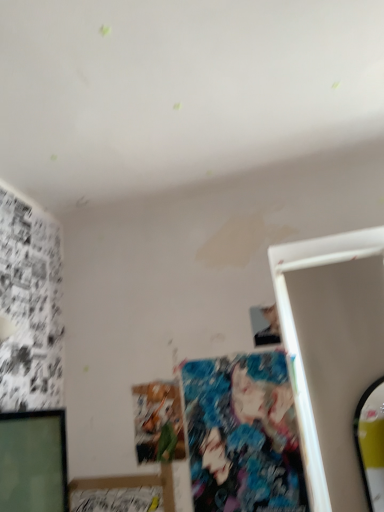
The width and height of the screenshot is (384, 512). What do you see at coordinates (158, 422) in the screenshot?
I see `matte paper poster at center, positioned as the 2th art in right-to-left order` at bounding box center [158, 422].

Where is `colorful fabric poster at center, acting as the second art starting from the left`? colorful fabric poster at center, acting as the second art starting from the left is located at coordinates (243, 435).

From a real-world perspective, does smooth black phone at upper right stand above matte paper poster at center, which is counted as the 1th art, starting from the left?

Correct, in the physical world, smooth black phone at upper right is higher than matte paper poster at center, which is counted as the 1th art, starting from the left.

Which is in front, point (264, 314) or point (159, 441)?

The point (159, 441) is more forward.

Is smooth black phone at upper right directly adjacent to matte paper poster at center, which is counted as the 1th art, starting from the left?

smooth black phone at upper right and matte paper poster at center, which is counted as the 1th art, starting from the left, are clearly separated.

How many degrees apart are the facing directions of smooth black phone at upper right and colorful fabric poster at center, acting as the 1th art starting from the right?

The angle between the facing direction of smooth black phone at upper right and the facing direction of colorful fabric poster at center, acting as the 1th art starting from the right, is 0.298 degrees.

Looking at this image, choose the correct answer: Is smooth black phone at upper right inside colorful fabric poster at center, acting as the 1th art starting from the right, or outside it?

smooth black phone at upper right is located beyond the bounds of colorful fabric poster at center, acting as the 1th art starting from the right.

Between smooth black phone at upper right and colorful fabric poster at center, acting as the 1th art starting from the right, which one has more height?

Standing taller between the two is colorful fabric poster at center, acting as the 1th art starting from the right.

Find the location of a particular element. person located on the right of colorful fabric poster at center, acting as the 1th art starting from the right is located at coordinates (265, 325).

Between colorful fabric poster at center, acting as the second art starting from the left, and matte paper poster at center, positioned as the 2th art in right-to-left order, which one has less height?

With less height is matte paper poster at center, positioned as the 2th art in right-to-left order.

Which is in front, point (269, 447) or point (171, 384)?

The point (269, 447) is more forward.

Considering the relative sizes of colorful fabric poster at center, acting as the second art starting from the left, and matte paper poster at center, positioned as the 2th art in right-to-left order, in the image provided, is colorful fabric poster at center, acting as the second art starting from the left, bigger than matte paper poster at center, positioned as the 2th art in right-to-left order,?

Indeed, colorful fabric poster at center, acting as the second art starting from the left, has a larger size compared to matte paper poster at center, positioned as the 2th art in right-to-left order.

Which object is positioned more to the left, colorful fabric poster at center, acting as the 1th art starting from the right, or matte paper poster at center, which is counted as the 1th art, starting from the left?

Positioned to the left is matte paper poster at center, which is counted as the 1th art, starting from the left.

Where is `person above the colorful fabric poster at center, acting as the second art starting from the left (from a real-world perspective)`? The height and width of the screenshot is (512, 384). person above the colorful fabric poster at center, acting as the second art starting from the left (from a real-world perspective) is located at coordinates (265, 325).

Could you tell me if colorful fabric poster at center, acting as the 1th art starting from the right, is turned towards smooth black phone at upper right?

No, colorful fabric poster at center, acting as the 1th art starting from the right, is not aimed at smooth black phone at upper right.

Which object is further away from the camera taking this photo, colorful fabric poster at center, acting as the 1th art starting from the right, or smooth black phone at upper right?

smooth black phone at upper right is more distant.

Is smooth black phone at upper right a part of colorful fabric poster at center, acting as the second art starting from the left?

No, colorful fabric poster at center, acting as the second art starting from the left, does not contain smooth black phone at upper right.

From the image's perspective, is matte paper poster at center, which is counted as the 1th art, starting from the left, located above smooth black phone at upper right?

Incorrect, from the image's perspective, matte paper poster at center, which is counted as the 1th art, starting from the left, is lower than smooth black phone at upper right.

Which is behind, matte paper poster at center, which is counted as the 1th art, starting from the left, or smooth black phone at upper right?

smooth black phone at upper right.

Does matte paper poster at center, which is counted as the 1th art, starting from the left, turn towards smooth black phone at upper right?

No, matte paper poster at center, which is counted as the 1th art, starting from the left, is not facing towards smooth black phone at upper right.

Locate an element on the screen. The width and height of the screenshot is (384, 512). art that appears below the colorful fabric poster at center, acting as the second art starting from the left (from the image's perspective) is located at coordinates (158, 422).

From their relative heights in the image, would you say matte paper poster at center, positioned as the 2th art in right-to-left order, is taller or shorter than colorful fabric poster at center, acting as the second art starting from the left?

matte paper poster at center, positioned as the 2th art in right-to-left order, is shorter than colorful fabric poster at center, acting as the second art starting from the left.

How much distance is there between matte paper poster at center, positioned as the 2th art in right-to-left order, and colorful fabric poster at center, acting as the second art starting from the left?

They are 8.07 inches apart.

In the scene shown: Which object is more forward, matte paper poster at center, which is counted as the 1th art, starting from the left, or colorful fabric poster at center, acting as the 1th art starting from the right?

colorful fabric poster at center, acting as the 1th art starting from the right, is in front.

Identify the location of the 1st art in front of the smooth black phone at upper right, counting from the anchor's position. The width and height of the screenshot is (384, 512). pos(158,422).

Locate an element on the screen. The height and width of the screenshot is (512, 384). person that appears above the colorful fabric poster at center, acting as the 1th art starting from the right (from the image's perspective) is located at coordinates (265, 325).

Looking at the image, which one is located further to colorful fabric poster at center, acting as the 1th art starting from the right, matte paper poster at center, positioned as the 2th art in right-to-left order, or smooth black phone at upper right?

smooth black phone at upper right lies further to colorful fabric poster at center, acting as the 1th art starting from the right, than the other object.

When comparing their distances from smooth black phone at upper right, does colorful fabric poster at center, acting as the second art starting from the left, or matte paper poster at center, positioned as the 2th art in right-to-left order, seem further?

matte paper poster at center, positioned as the 2th art in right-to-left order.

Which object lies nearer to the anchor point matte paper poster at center, positioned as the 2th art in right-to-left order, smooth black phone at upper right or colorful fabric poster at center, acting as the 1th art starting from the right?

Based on the image, colorful fabric poster at center, acting as the 1th art starting from the right, appears to be nearer to matte paper poster at center, positioned as the 2th art in right-to-left order.

When comparing their distances from matte paper poster at center, positioned as the 2th art in right-to-left order, does colorful fabric poster at center, acting as the second art starting from the left, or smooth black phone at upper right seem further?

smooth black phone at upper right is further to matte paper poster at center, positioned as the 2th art in right-to-left order.

When comparing their distances from smooth black phone at upper right, does matte paper poster at center, positioned as the 2th art in right-to-left order, or colorful fabric poster at center, acting as the second art starting from the left, seem closer?

colorful fabric poster at center, acting as the second art starting from the left, is closer to smooth black phone at upper right.

Which object lies nearer to the anchor point colorful fabric poster at center, acting as the 1th art starting from the right, smooth black phone at upper right or matte paper poster at center, which is counted as the 1th art, starting from the left?

The object closer to colorful fabric poster at center, acting as the 1th art starting from the right, is matte paper poster at center, which is counted as the 1th art, starting from the left.

Where is `art between smooth black phone at upper right and matte paper poster at center, positioned as the 2th art in right-to-left order, from top to bottom`? The image size is (384, 512). art between smooth black phone at upper right and matte paper poster at center, positioned as the 2th art in right-to-left order, from top to bottom is located at coordinates (243, 435).